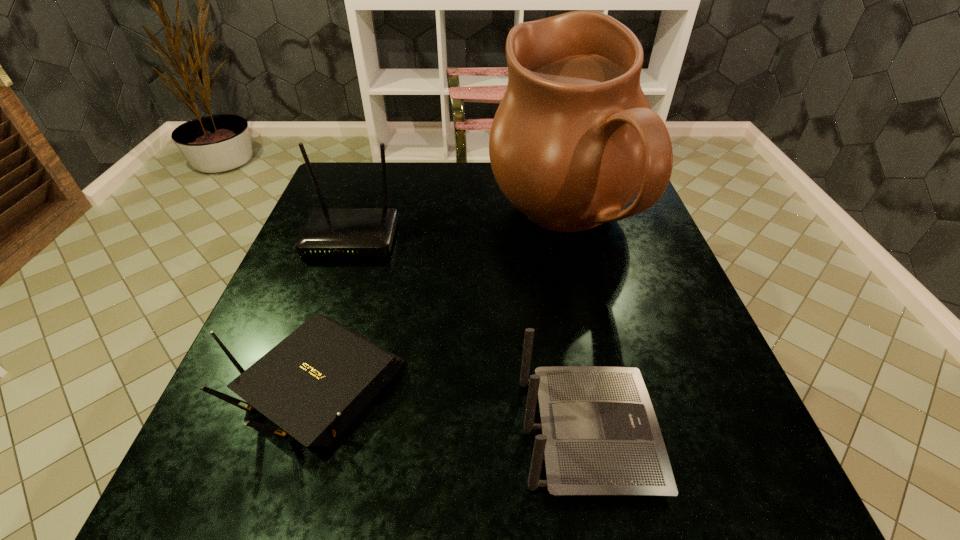
Identify the location of free point between the shortest object and the third tallest object. This screenshot has width=960, height=540. (452, 408).

At what (x,y) coordinates should I click in order to perform the action: click on free point between the shortest object and the tallest object. Please return your answer as a coordinate pair (x, y). Looking at the image, I should click on (441, 303).

Point out which object is positioned as the second nearest to the third shortest object. Please provide its 2D coordinates. Your answer should be formatted as a tuple, i.e. [(x, y)], where the tuple contains the x and y coordinates of a point satisfying the conditions above.

[(574, 140)]

I want to click on object that is the second closest to the cream pitcher, so click(x=600, y=436).

Locate which router ranks in proximity to the third shortest object. Please provide its 2D coordinates. Your answer should be formatted as a tuple, i.e. [(x, y)], where the tuple contains the x and y coordinates of a point satisfying the conditions above.

[(314, 383)]

The height and width of the screenshot is (540, 960). What are the coordinates of `the second closest router to the cream pitcher` in the screenshot? It's located at (600, 436).

Where is `free location that satisfies the following two spatial constraints: 1. at the spout of the tallest object; 2. on the front-facing side of the second tallest object`? This screenshot has width=960, height=540. free location that satisfies the following two spatial constraints: 1. at the spout of the tallest object; 2. on the front-facing side of the second tallest object is located at coordinates (567, 238).

Image resolution: width=960 pixels, height=540 pixels. Find the location of `vacant area in the image that satisfies the following two spatial constraints: 1. at the spout of the tallest object; 2. on the front-facing side of the farthest router`. vacant area in the image that satisfies the following two spatial constraints: 1. at the spout of the tallest object; 2. on the front-facing side of the farthest router is located at coordinates (567, 238).

Find the location of `vacant space that satisfies the following two spatial constraints: 1. on the front-facing side of the tallest router; 2. on the front-facing side of the second tallest router`. vacant space that satisfies the following two spatial constraints: 1. on the front-facing side of the tallest router; 2. on the front-facing side of the second tallest router is located at coordinates (284, 433).

Where is `free point that satisfies the following two spatial constraints: 1. on the front-facing side of the second tallest router; 2. on the front side of the shortest object`? free point that satisfies the following two spatial constraints: 1. on the front-facing side of the second tallest router; 2. on the front side of the shortest object is located at coordinates (579, 383).